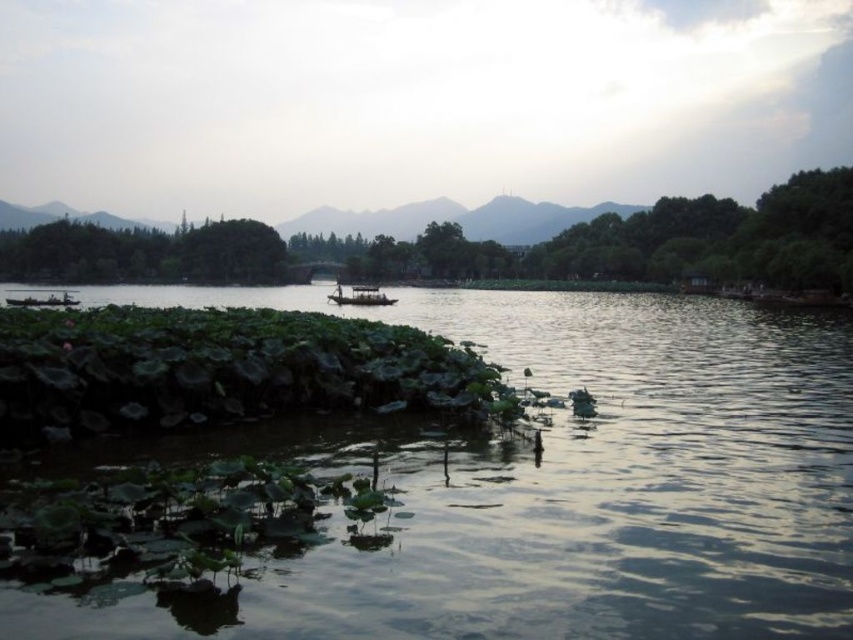
Does green leafy river at center lie in front of wooden boat at left?

That is True.

The height and width of the screenshot is (640, 853). What do you see at coordinates (552, 484) in the screenshot? I see `green leafy river at center` at bounding box center [552, 484].

Image resolution: width=853 pixels, height=640 pixels. I want to click on green leafy river at center, so click(x=552, y=484).

Does green leafy river at center come behind wooden boat at center?

That is False.

Who is more forward, (570,326) or (372,289)?

Point (570,326)

Find the location of a particular element. The image size is (853, 640). green leafy river at center is located at coordinates (552, 484).

Between wooden boat at center and wooden boat at left, which one has less height?

wooden boat at left

Between point (354, 291) and point (71, 305), which one is positioned in front?

Positioned in front is point (71, 305).

The image size is (853, 640). I want to click on wooden boat at center, so click(358, 296).